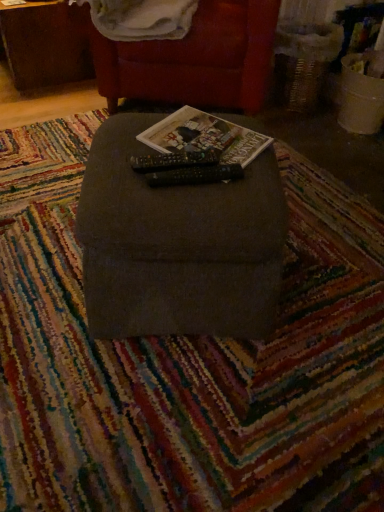
In order to click on free space that is to the left of dark gray fabric ottoman at center, the first furniture in the bottom-to-top sequence in this screenshot , I will do `click(41, 252)`.